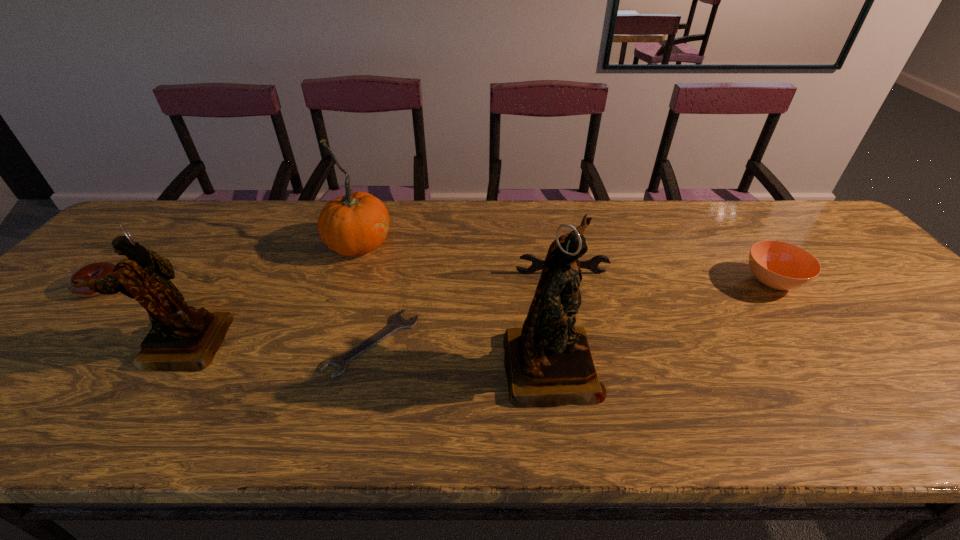
This screenshot has width=960, height=540. In the image, there is a desktop. Find the location of `vacant space at the near right corner`. vacant space at the near right corner is located at coordinates (934, 385).

Identify the location of free spot between the nearer wrench and the second object from left to right. This screenshot has height=540, width=960. (278, 344).

What are the coordinates of `vacant area that lies between the sixth tallest object and the tallest object` in the screenshot? It's located at (325, 325).

At what (x,y) coordinates should I click in order to perform the action: click on free space between the taller figurine and the rightmost object. Please return your answer as a coordinate pair (x, y). This screenshot has width=960, height=540. Looking at the image, I should click on (661, 322).

This screenshot has height=540, width=960. What are the coordinates of `free spot between the right figurine and the doughnut` in the screenshot? It's located at point(325,325).

At what (x,y) coordinates should I click in order to perform the action: click on free space between the second shortest object and the taller wrench. Please return your answer as a coordinate pair (x, y). The height and width of the screenshot is (540, 960). Looking at the image, I should click on (331, 280).

Find the location of a particular element. The height and width of the screenshot is (540, 960). unoccupied area between the pumpkin and the leftmost object is located at coordinates (229, 265).

Identify the location of unoccupied area between the leftmost object and the pumpkin. (229, 265).

The image size is (960, 540). I want to click on vacant area that lies between the shortest object and the taller wrench, so click(468, 308).

I want to click on free space between the rightmost object and the right figurine, so click(x=661, y=322).